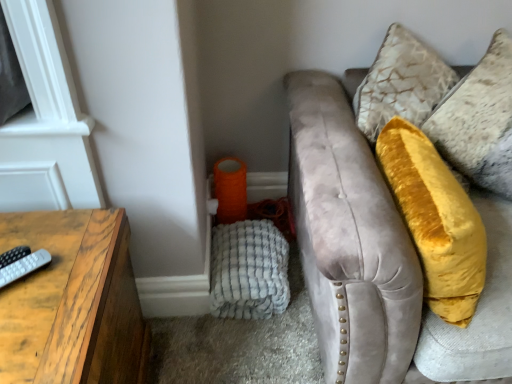
Identify the location of vacant area on top of white textured blanket at lower left (from a real-world perspective). (242, 261).